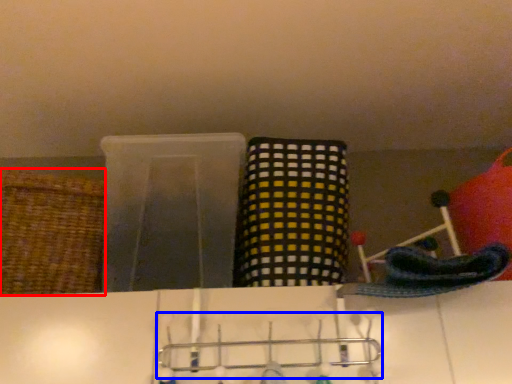
Question: Which point is further to the camera, basket (highlighted by a red box) or hanger (highlighted by a blue box)?

Choices:
 (A) basket
 (B) hanger

Answer: (A)